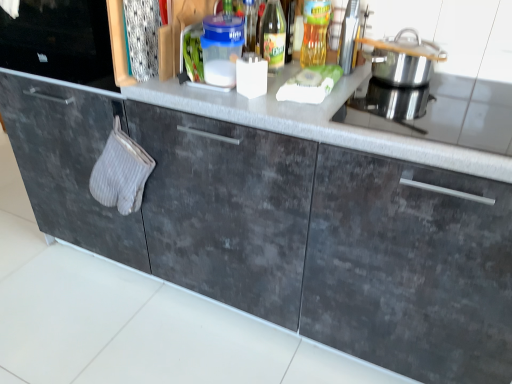
At what (x,y) coordinates should I click in order to perform the action: click on translucent glass bottle at upper center, which ranks as the first bottle in left-to-right order. Please return your answer as a coordinate pair (x, y). The height and width of the screenshot is (384, 512). Looking at the image, I should click on (273, 35).

What are the coordinates of `transparent glass bottle at center, the second bottle viewed from the left` in the screenshot? It's located at (315, 32).

The image size is (512, 384). Identify the location of translucent glass bottle at upper center, which ranks as the first bottle in left-to-right order. (273, 35).

Looking at this image, can you confirm if metallic silver toaster at upper right is smaller than silver metallic pot at upper right?

Yes, metallic silver toaster at upper right is smaller than silver metallic pot at upper right.

Locate an element on the screen. This screenshot has height=384, width=512. appliance above the silver metallic pot at upper right (from the image's perspective) is located at coordinates (349, 37).

From the image's perspective, relative to silver metallic pot at upper right, is metallic silver toaster at upper right above or below?

Based on their image positions, metallic silver toaster at upper right is located above silver metallic pot at upper right.

Is metallic silver toaster at upper right far away from silver metallic pot at upper right?

They are positioned close to each other.

Which object is further away from the camera, gray textured oven mitt at left or metallic silver toaster at upper right?

gray textured oven mitt at left is further away from the camera.

Is gray textured oven mitt at left not within metallic silver toaster at upper right?

Yes, gray textured oven mitt at left is not within metallic silver toaster at upper right.

In terms of size, does gray textured oven mitt at left appear bigger or smaller than metallic silver toaster at upper right?

Considering their sizes, gray textured oven mitt at left takes up more space than metallic silver toaster at upper right.

Is gray textured oven mitt at left placed right next to metallic silver toaster at upper right?

No.

Can we say silver metallic pot at upper right lies outside gray textured oven mitt at left?

That's correct, silver metallic pot at upper right is outside of gray textured oven mitt at left.

Would you consider silver metallic pot at upper right to be distant from gray textured oven mitt at left?

They are positioned close to each other.

In the image, is silver metallic pot at upper right positioned in front of or behind gray textured oven mitt at left?

silver metallic pot at upper right is in front of gray textured oven mitt at left.

How many degrees apart are the facing directions of transparent glass bottle at center, the second bottle viewed from the left, and metallic silver toaster at upper right?

There is a 89.3-degree angle between the facing directions of transparent glass bottle at center, the second bottle viewed from the left, and metallic silver toaster at upper right.

From a real-world perspective, is transparent glass bottle at center, acting as the first bottle starting from the right, over metallic silver toaster at upper right?

No, from a real-world perspective, transparent glass bottle at center, acting as the first bottle starting from the right, is not on top of metallic silver toaster at upper right.

Considering the sizes of objects transparent glass bottle at center, the second bottle viewed from the left, and metallic silver toaster at upper right in the image provided, who is smaller, transparent glass bottle at center, the second bottle viewed from the left, or metallic silver toaster at upper right?

transparent glass bottle at center, the second bottle viewed from the left, is smaller.

Could you tell me if transparent glass bottle at center, acting as the first bottle starting from the right, is facing metallic silver toaster at upper right?

No, transparent glass bottle at center, acting as the first bottle starting from the right, is not aimed at metallic silver toaster at upper right.

From a real-world perspective, is metallic silver toaster at upper right physically above gray textured oven mitt at left?

Yes.

This screenshot has width=512, height=384. In order to click on appliance that is above the gray textured oven mitt at left (from the image's perspective) in this screenshot , I will do `click(349, 37)`.

Would you say gray textured oven mitt at left is part of metallic silver toaster at upper right's contents?

Definitely not — gray textured oven mitt at left is not inside metallic silver toaster at upper right.

Considering the sizes of objects metallic silver toaster at upper right and gray textured oven mitt at left in the image provided, who is smaller, metallic silver toaster at upper right or gray textured oven mitt at left?

With smaller size is metallic silver toaster at upper right.

Between transparent glass bottle at center, the second bottle viewed from the left, and gray textured oven mitt at left, which one has larger width?

gray textured oven mitt at left is wider.

Between transparent glass bottle at center, acting as the first bottle starting from the right, and gray textured oven mitt at left, which one has more height?

With more height is gray textured oven mitt at left.

Locate an element on the screen. hand towel below the transparent glass bottle at center, the second bottle viewed from the left (from a real-world perspective) is located at coordinates (121, 172).

From a real-world perspective, which is physically below, transparent glass bottle at center, acting as the first bottle starting from the right, or gray textured oven mitt at left?

gray textured oven mitt at left is physically lower.

Which object is wider, translucent glass bottle at upper center, the 2th bottle in the right-to-left sequence, or metallic silver toaster at upper right?

translucent glass bottle at upper center, the 2th bottle in the right-to-left sequence.

Which object is closer to the camera taking this photo, translucent glass bottle at upper center, the 2th bottle in the right-to-left sequence, or metallic silver toaster at upper right?

translucent glass bottle at upper center, the 2th bottle in the right-to-left sequence.

How far apart are translucent glass bottle at upper center, the 2th bottle in the right-to-left sequence, and metallic silver toaster at upper right?

translucent glass bottle at upper center, the 2th bottle in the right-to-left sequence, and metallic silver toaster at upper right are 8.11 inches apart.

From the picture: Is translucent glass bottle at upper center, the 2th bottle in the right-to-left sequence, taller or shorter than metallic silver toaster at upper right?

Considering their sizes, translucent glass bottle at upper center, the 2th bottle in the right-to-left sequence, has less height than metallic silver toaster at upper right.

The width and height of the screenshot is (512, 384). Identify the location of appliance located above the silver metallic pot at upper right (from the image's perspective). (349, 37).

Identify the location of hand towel behind the metallic silver toaster at upper right. (121, 172).

Which object lies nearer to the anchor point gray textured oven mitt at left, transparent glass bottle at center, the second bottle viewed from the left, or translucent glass bottle at upper center, which ranks as the first bottle in left-to-right order?

translucent glass bottle at upper center, which ranks as the first bottle in left-to-right order, is positioned closer to the anchor gray textured oven mitt at left.

From the image, which object appears to be nearer to silver metallic pot at upper right, translucent glass bottle at upper center, which ranks as the first bottle in left-to-right order, or metallic silver toaster at upper right?

The object closer to silver metallic pot at upper right is metallic silver toaster at upper right.

Looking at the image, which one is located further to silver metallic pot at upper right, gray textured oven mitt at left or transparent glass bottle at center, the second bottle viewed from the left?

gray textured oven mitt at left.

Considering their positions, is silver metallic pot at upper right positioned closer to metallic silver toaster at upper right than gray textured oven mitt at left?

silver metallic pot at upper right is closer to metallic silver toaster at upper right.

Which object lies nearer to the anchor point transparent glass bottle at center, acting as the first bottle starting from the right, gray textured oven mitt at left or translucent glass bottle at upper center, which ranks as the first bottle in left-to-right order?

Based on the image, translucent glass bottle at upper center, which ranks as the first bottle in left-to-right order, appears to be nearer to transparent glass bottle at center, acting as the first bottle starting from the right.

When comparing their distances from translucent glass bottle at upper center, the 2th bottle in the right-to-left sequence, does gray textured oven mitt at left or metallic silver toaster at upper right seem closer?

metallic silver toaster at upper right is closer to translucent glass bottle at upper center, the 2th bottle in the right-to-left sequence.

From the image, which object appears to be farther from transparent glass bottle at center, acting as the first bottle starting from the right, metallic silver toaster at upper right or translucent glass bottle at upper center, which ranks as the first bottle in left-to-right order?

The object further to transparent glass bottle at center, acting as the first bottle starting from the right, is translucent glass bottle at upper center, which ranks as the first bottle in left-to-right order.

Looking at the image, which one is located closer to translucent glass bottle at upper center, which ranks as the first bottle in left-to-right order, transparent glass bottle at center, acting as the first bottle starting from the right, or gray textured oven mitt at left?

transparent glass bottle at center, acting as the first bottle starting from the right, lies closer to translucent glass bottle at upper center, which ranks as the first bottle in left-to-right order, than the other object.

Identify the location of bottle situated between gray textured oven mitt at left and transparent glass bottle at center, acting as the first bottle starting from the right, from left to right. (273, 35).

The width and height of the screenshot is (512, 384). I want to click on appliance between transparent glass bottle at center, the second bottle viewed from the left, and silver metallic pot at upper right, so click(349, 37).

Locate an element on the screen. This screenshot has width=512, height=384. bottle located between translucent glass bottle at upper center, which ranks as the first bottle in left-to-right order, and metallic silver toaster at upper right in the left-right direction is located at coordinates (315, 32).

Identify the location of appliance between gray textured oven mitt at left and silver metallic pot at upper right in the horizontal direction. (349, 37).